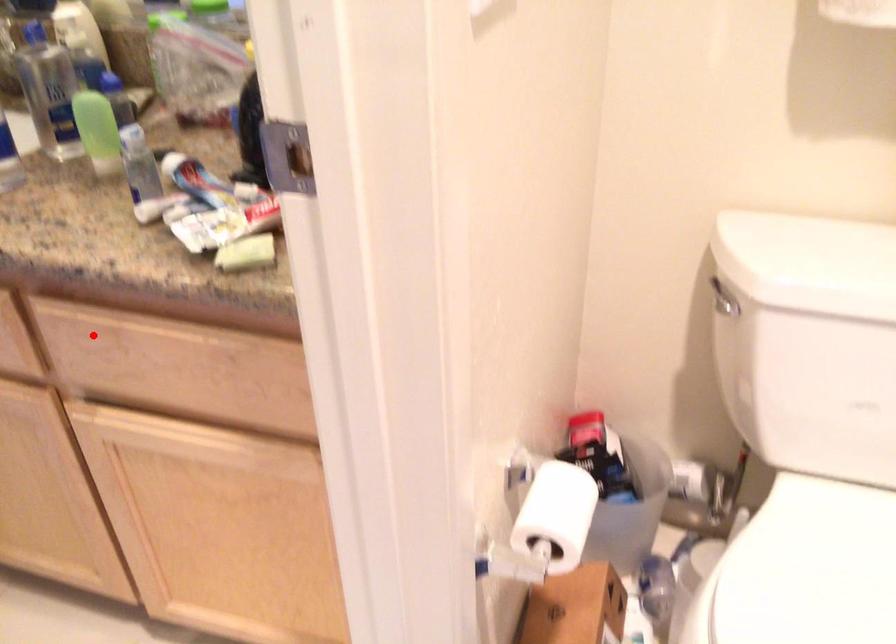
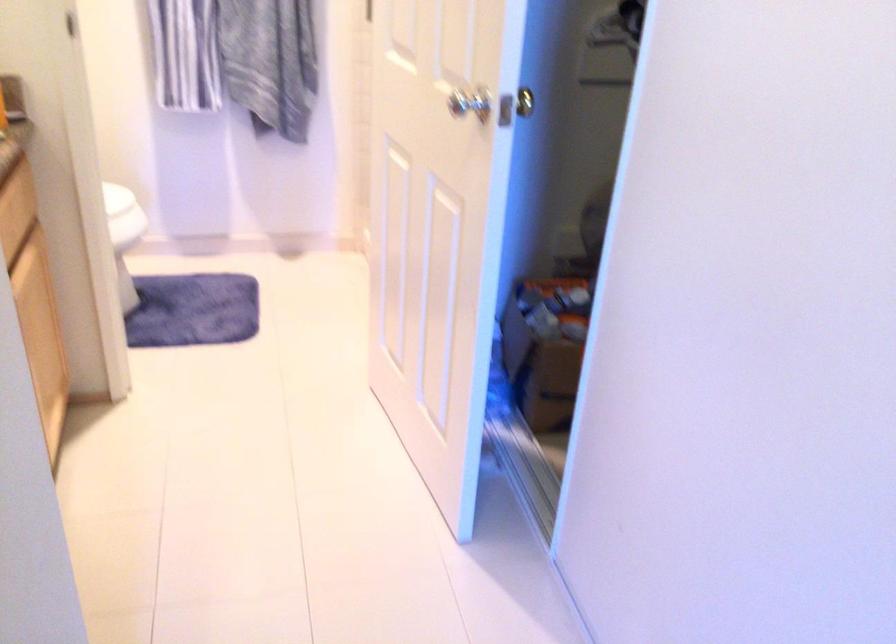
Locate, in the second image, the point that corresponds to the highlighted location in the first image.

(12, 229)